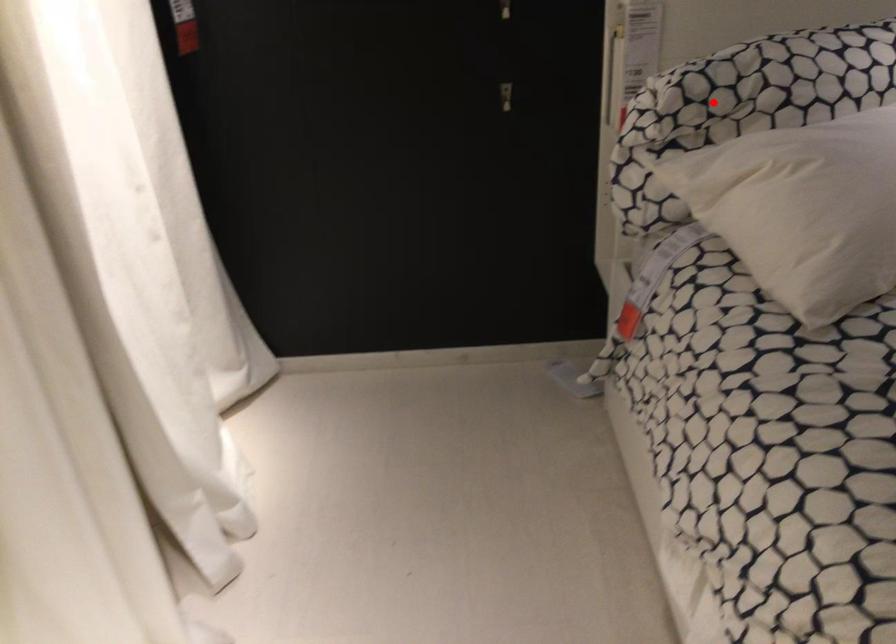
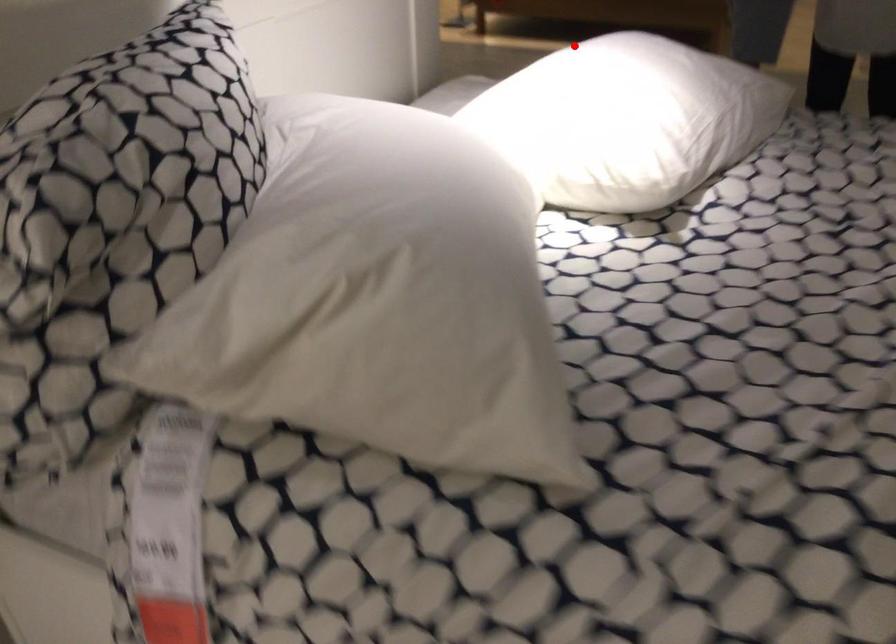
I am providing you with two images of the same scene from different viewpoints. A red point is marked on the first image and another point is marked on the second image. Are the points marked in image1 and image2 representing the same 3D position?

No